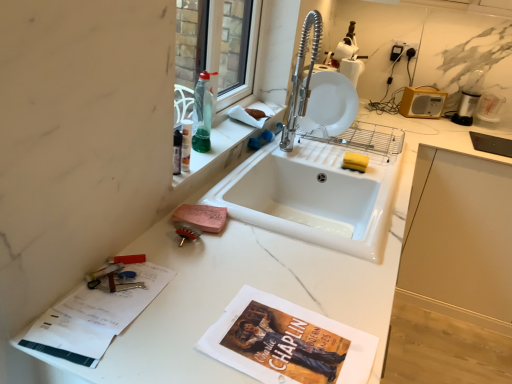
Question: Does transparent glass window at upper center have a lesser height compared to white plastic radio at upper right?

Choices:
 (A) yes
 (B) no

Answer: (B)

Question: Does transparent glass window at upper center have a larger size compared to white plastic radio at upper right?

Choices:
 (A) no
 (B) yes

Answer: (B)

Question: Is transparent glass window at upper center not inside white plastic radio at upper right?

Choices:
 (A) no
 (B) yes

Answer: (B)

Question: Considering the relative sizes of transparent glass window at upper center and white plastic radio at upper right in the image provided, is transparent glass window at upper center smaller than white plastic radio at upper right?

Choices:
 (A) yes
 (B) no

Answer: (B)

Question: From the image's perspective, is transparent glass window at upper center on top of white plastic radio at upper right?

Choices:
 (A) yes
 (B) no

Answer: (A)

Question: Does point (317, 86) appear closer or farther from the camera than point (424, 109)?

Choices:
 (A) closer
 (B) farther

Answer: (A)

Question: From the image's perspective, is white glossy plate at upper center located above or below white plastic radio at upper right?

Choices:
 (A) below
 (B) above

Answer: (A)

Question: From a real-world perspective, relative to white plastic radio at upper right, is white glossy plate at upper center vertically above or below?

Choices:
 (A) below
 (B) above

Answer: (B)

Question: From their relative heights in the image, would you say white glossy plate at upper center is taller or shorter than white plastic radio at upper right?

Choices:
 (A) short
 (B) tall

Answer: (B)

Question: In the image, is translucent green liquid at sink left on the left side or the right side of white plastic radio at upper right?

Choices:
 (A) left
 (B) right

Answer: (A)

Question: Considering the positions of translucent green liquid at sink left and white plastic radio at upper right in the image, is translucent green liquid at sink left taller or shorter than white plastic radio at upper right?

Choices:
 (A) tall
 (B) short

Answer: (A)

Question: In the image, is translucent green liquid at sink left positioned in front of or behind white plastic radio at upper right?

Choices:
 (A) front
 (B) behind

Answer: (A)

Question: In terms of size, does translucent green liquid at sink left appear bigger or smaller than white plastic radio at upper right?

Choices:
 (A) big
 (B) small

Answer: (B)

Question: Considering the relative positions of transparent glass window at upper center and white marble countertop at center in the image provided, is transparent glass window at upper center to the left or to the right of white marble countertop at center?

Choices:
 (A) right
 (B) left

Answer: (B)

Question: Is transparent glass window at upper center bigger or smaller than white marble countertop at center?

Choices:
 (A) big
 (B) small

Answer: (B)